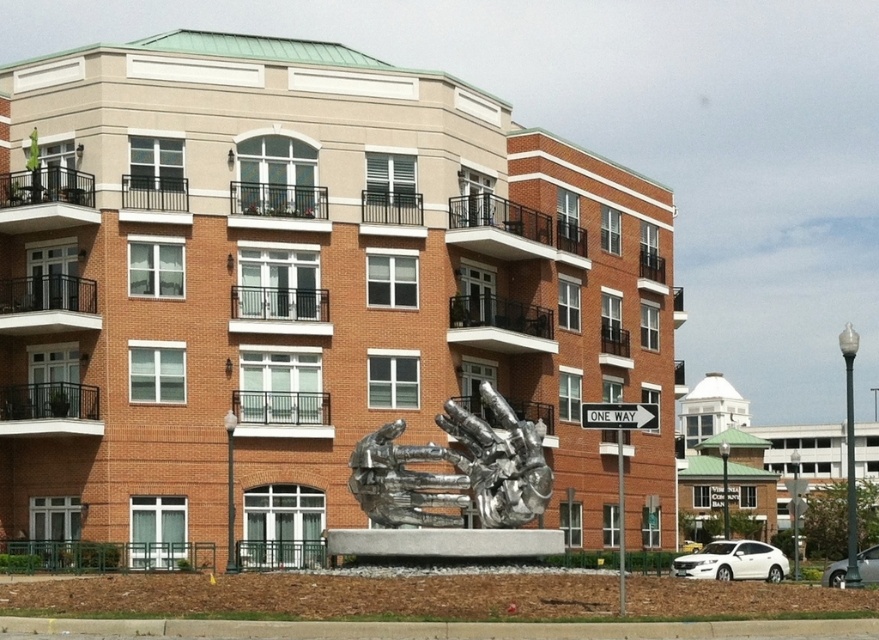
Question: Which point is farther to the camera?

Choices:
 (A) silver metallic hands at center
 (B) white plastic street sign at center right

Answer: (A)

Question: Does silver metallic hands at center have a lesser width compared to white plastic street sign at center right?

Choices:
 (A) no
 (B) yes

Answer: (B)

Question: Which point is farther to the camera?

Choices:
 (A) (474, 468)
 (B) (641, 412)

Answer: (A)

Question: Which point is closer to the camera taking this photo?

Choices:
 (A) (631, 408)
 (B) (524, 500)

Answer: (A)

Question: Is silver metallic hands at center to the left of white plastic street sign at center right from the viewer's perspective?

Choices:
 (A) yes
 (B) no

Answer: (A)

Question: Does silver metallic hands at center appear under white plastic street sign at center right?

Choices:
 (A) yes
 (B) no

Answer: (A)